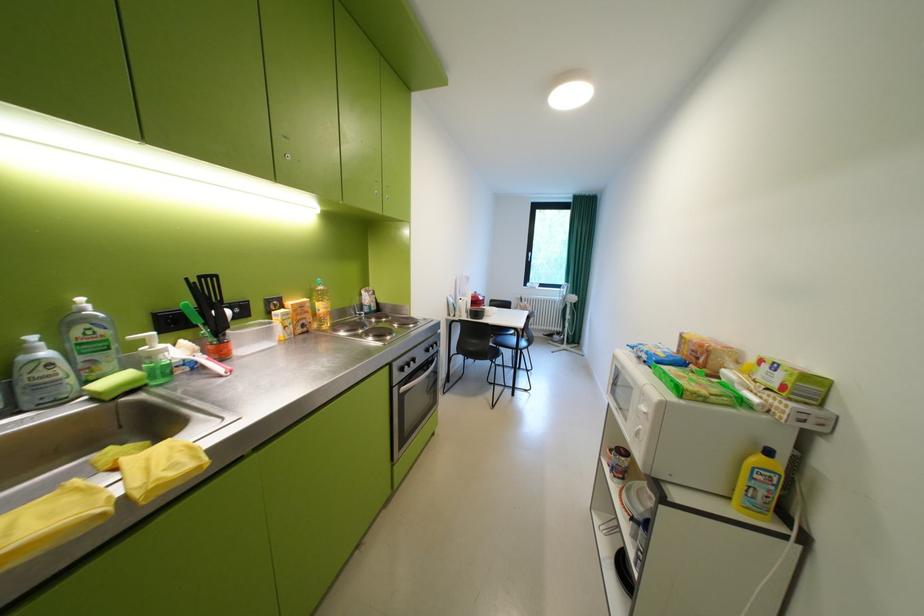
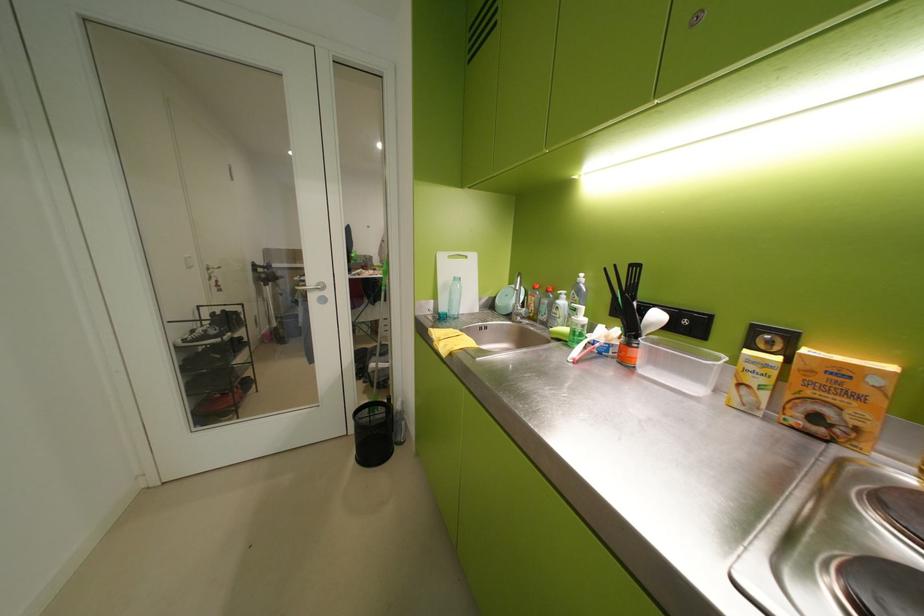
Find the pixel in the second image that matches pixel 296 315 in the first image.

(773, 365)